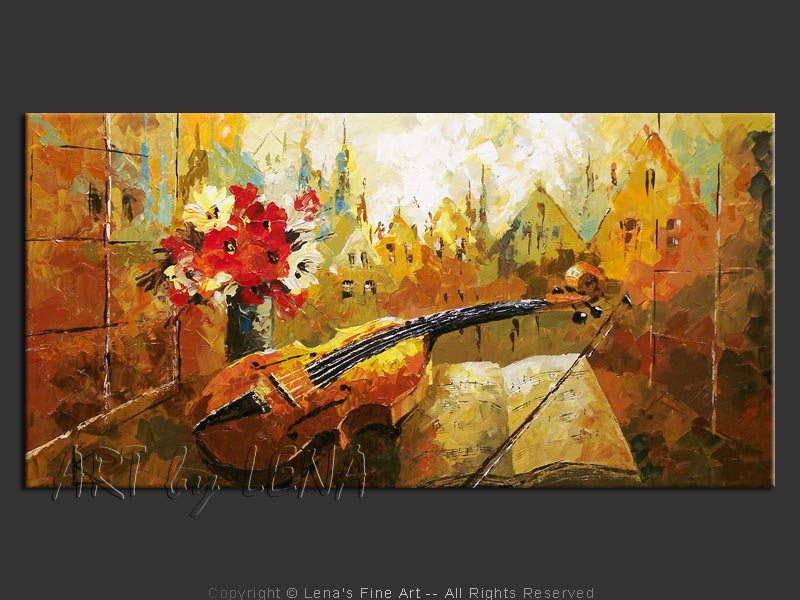
I want to click on open book, so click(552, 401).